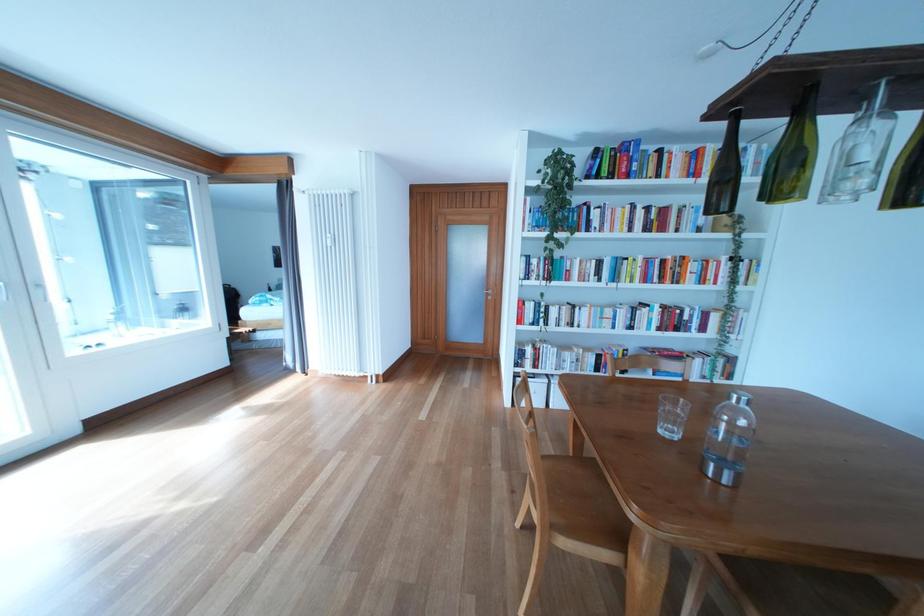
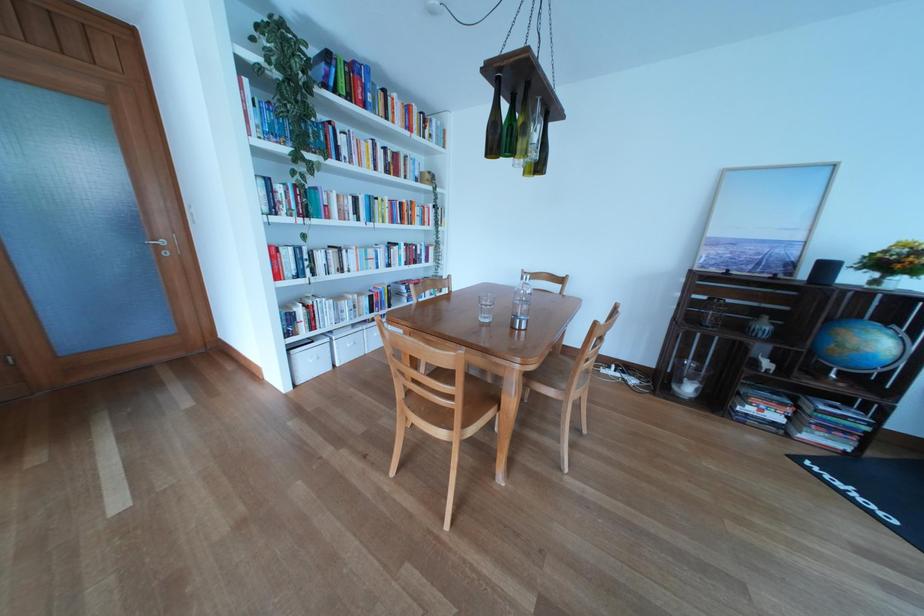
In the second image, find the point that corresponds to [560,387] in the first image.

(341, 345)